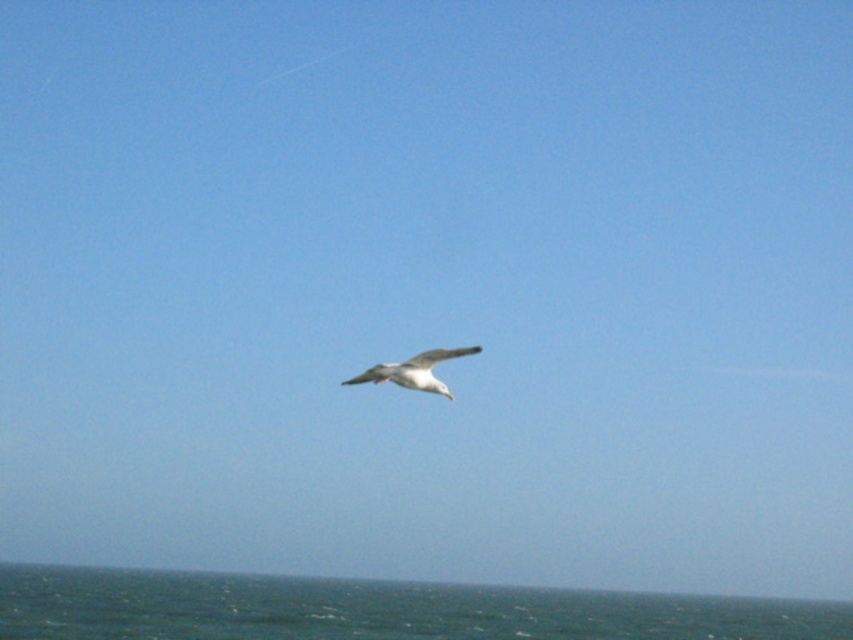
From the picture: Does greenish-blue water at lower center appear on the left side of white feathered bird at center?

Indeed, greenish-blue water at lower center is positioned on the left side of white feathered bird at center.

The image size is (853, 640). I want to click on greenish-blue water at lower center, so coord(375,609).